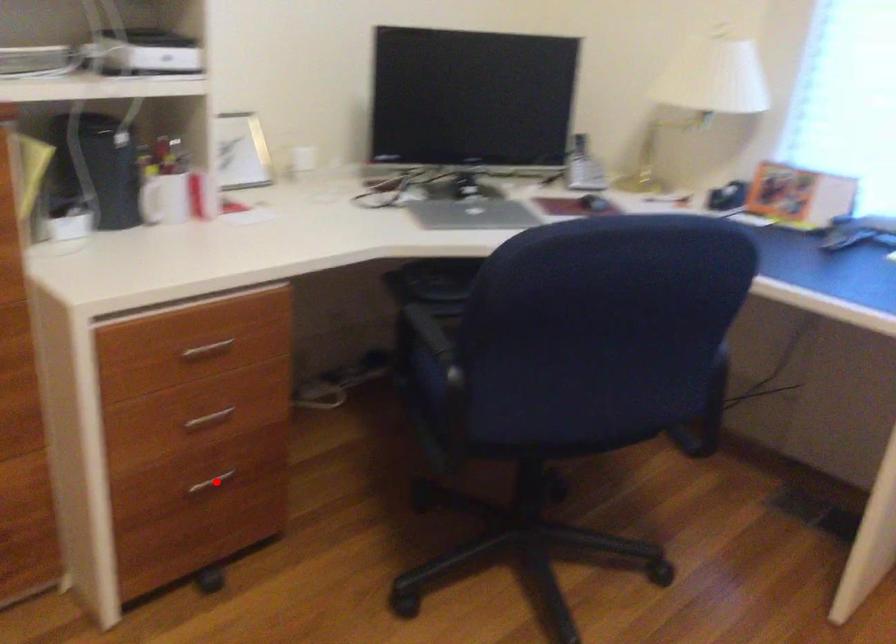
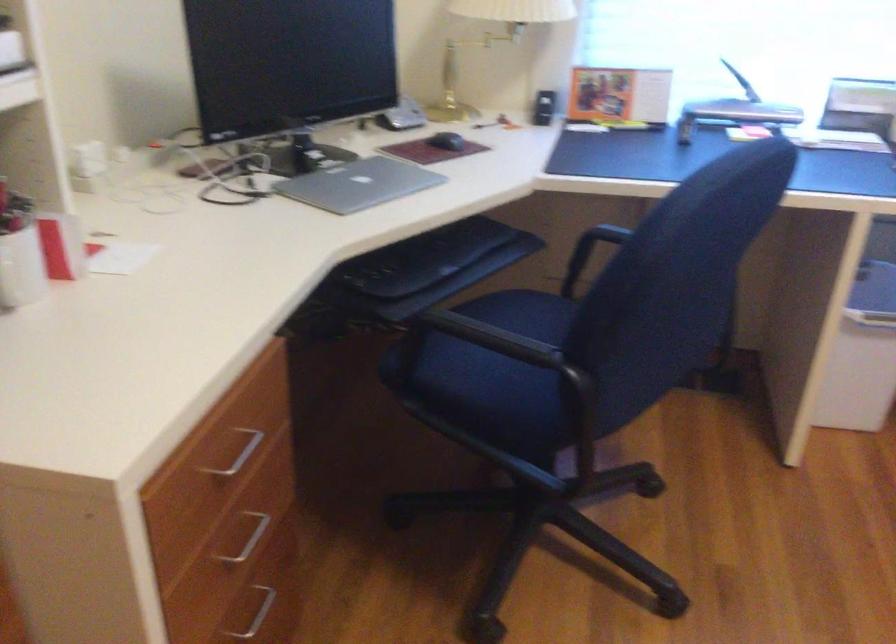
The point at the highlighted location is marked in the first image. Where is the corresponding point in the second image?

(254, 612)